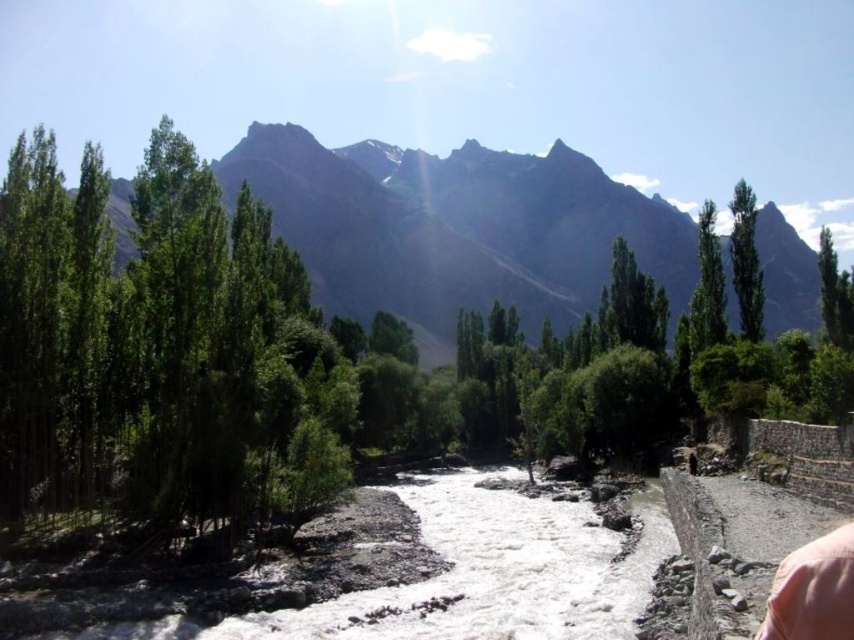
You are an environmental scientist assessing the landscape. You need to determine which object is shorter between the white rocky creek at center and the green leafy tree at upper right. Based on the scene, which one is shorter?

The white rocky creek at center is shorter than the green leafy tree at upper right.